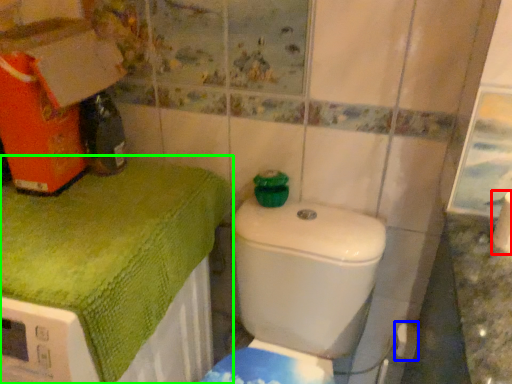
Question: Which object is the farthest from toilet paper (highlighted by a red box)? Choose among these: toilet paper (highlighted by a blue box) or bath towel (highlighted by a green box).

Choices:
 (A) toilet paper
 (B) bath towel

Answer: (B)